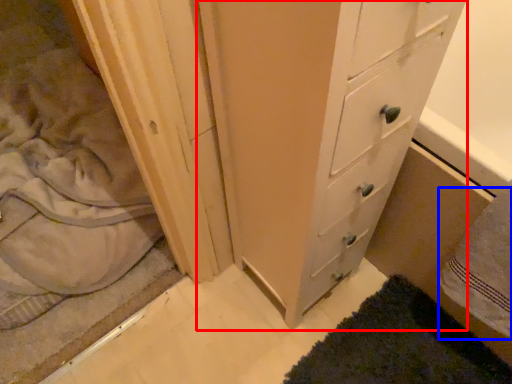
Question: Which point is further to the camera, chest of drawers (highlighted by a red box) or bath towel (highlighted by a blue box)?

Choices:
 (A) chest of drawers
 (B) bath towel

Answer: (B)